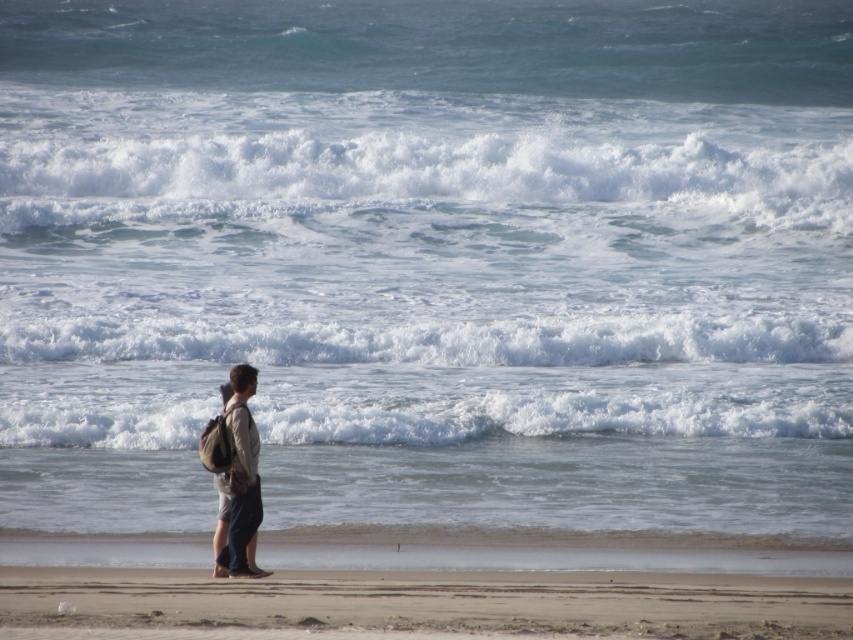
You are a photographer trying to capture the scene from the beach. You want to position yourself so that the white frothy wave at upper center is visible above the light brown fabric backpack at center in your photo. Is this possible based on their current positions?

Yes, the white frothy wave at upper center is already positioned above the light brown fabric backpack at center, so capturing this arrangement in the photo is possible.

You are standing on the beach and see the white frothy wave at upper center approaching you. If you can run at a speed of 5 meters per second, how many seconds do you have before the wave reaches you?

The white frothy wave at upper center is 29.32 meters away. At a running speed of 5 meters per second, you have approximately 5.86 seconds to reach safety before the wave arrives.

You are a photographer trying to capture the white frothy wave at upper center and the sandy beach at lower center in a single frame. Which object should you focus on first if you want to ensure both are in the shot without moving the camera?

You should focus on the white frothy wave at upper center first because it is positioned over the sandy beach at lower center, so adjusting focus on the wave will naturally include the beach in the frame.